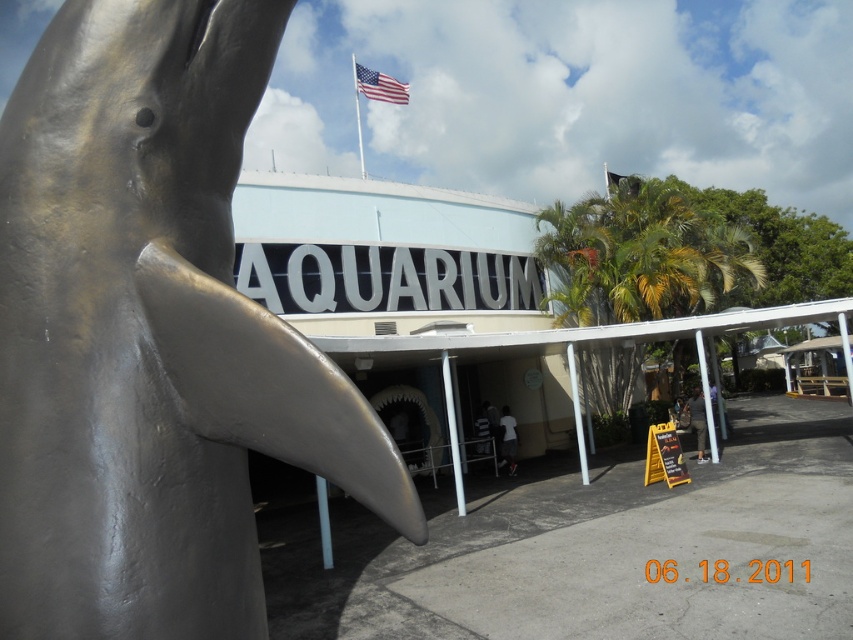
Question: Which of the following is the closest to the observer?

Choices:
 (A) (144, 307)
 (B) (386, 76)

Answer: (A)

Question: Is shiny silver dolphin at left wider than american flag at upper center?

Choices:
 (A) no
 (B) yes

Answer: (A)

Question: Is shiny silver dolphin at left closer to camera compared to american flag at upper center?

Choices:
 (A) yes
 (B) no

Answer: (A)

Question: Which of the following is the closest to the observer?

Choices:
 (A) (129, 172)
 (B) (374, 92)

Answer: (A)

Question: In this image, where is shiny silver dolphin at left located relative to american flag at upper center?

Choices:
 (A) right
 (B) left

Answer: (A)